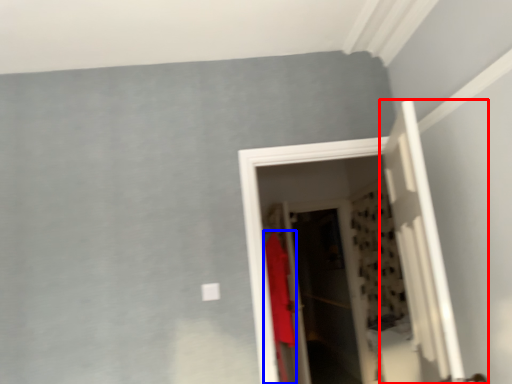
Question: Which point is further to the camera, door (highlighted by a red box) or clothing (highlighted by a blue box)?

Choices:
 (A) door
 (B) clothing

Answer: (B)